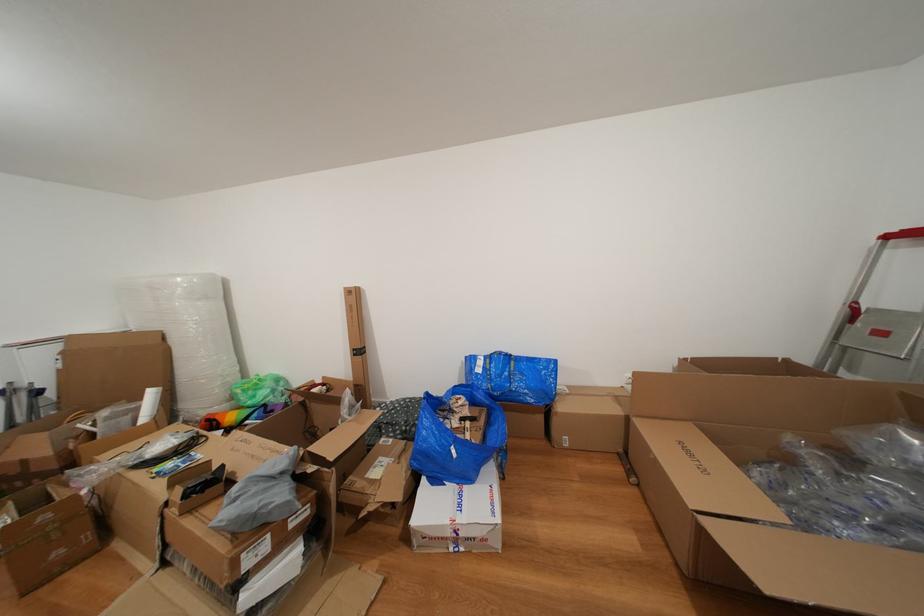
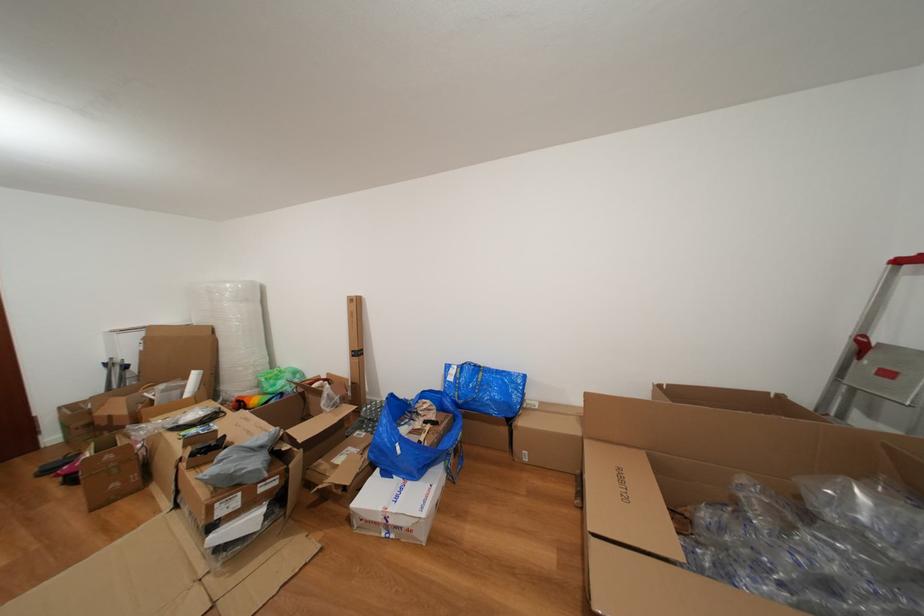
Question: Which direction would the cameraman need to move to produce the second image? Reply with the corresponding letter.

Choices:
 (A) Left
 (B) Right
 (C) Forward
 (D) Backward

Answer: (B)